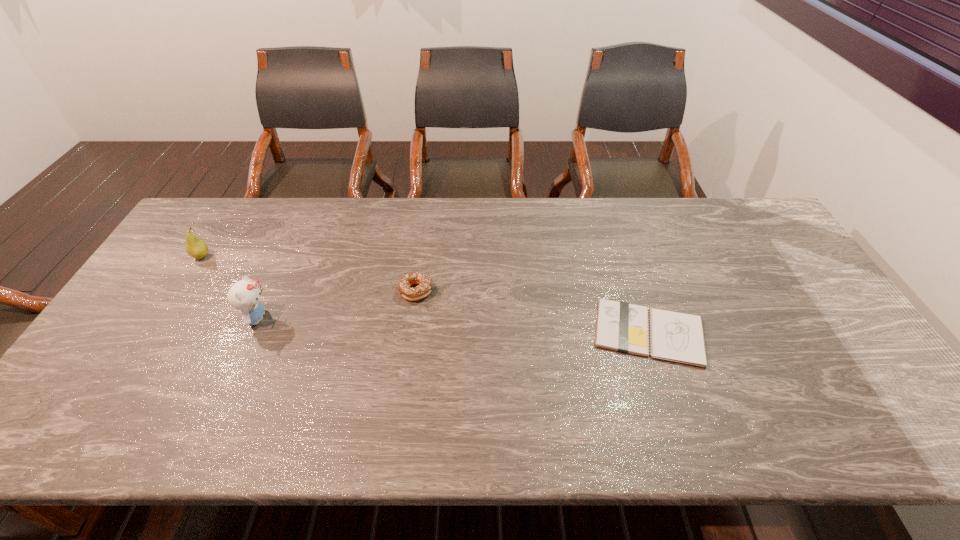
I want to click on free space that is in between the second shortest object and the leftmost object, so click(309, 274).

You are a GUI agent. You are given a task and a screenshot of the screen. Output one action in this format:
    pyautogui.click(x=<x>, y=<y>)
    Task: Click on the unoccupied area between the notepad and the doughnut
    Image resolution: width=960 pixels, height=540 pixels.
    Given the screenshot: What is the action you would take?
    pyautogui.click(x=533, y=312)

You are a GUI agent. You are given a task and a screenshot of the screen. Output one action in this format:
    pyautogui.click(x=<x>, y=<y>)
    Task: Click on the vacant space in between the rightmost object and the second object from right to left
    
    Given the screenshot: What is the action you would take?
    pyautogui.click(x=533, y=312)

Locate an element on the screen. unoccupied area between the shortest object and the kitten is located at coordinates (453, 325).

This screenshot has height=540, width=960. I want to click on vacant area between the pear and the third tallest object, so click(309, 274).

Find the location of a particular element. The height and width of the screenshot is (540, 960). object that can be found as the second closest to the third object from left to right is located at coordinates (623, 327).

What are the coordinates of `object that can be found as the second closest to the kitten` in the screenshot? It's located at (424, 288).

The width and height of the screenshot is (960, 540). What are the coordinates of `vacant area that satisfies the following two spatial constraints: 1. on the front side of the doughnut; 2. on the front-facing side of the kitten` in the screenshot? It's located at (413, 318).

Locate an element on the screen. This screenshot has width=960, height=540. vacant space that satisfies the following two spatial constraints: 1. on the back side of the rightmost object; 2. on the front-facing side of the second object from left to right is located at coordinates (644, 318).

Image resolution: width=960 pixels, height=540 pixels. Identify the location of vacant position in the image that satisfies the following two spatial constraints: 1. on the back side of the notepad; 2. on the front-facing side of the kitten. (644, 318).